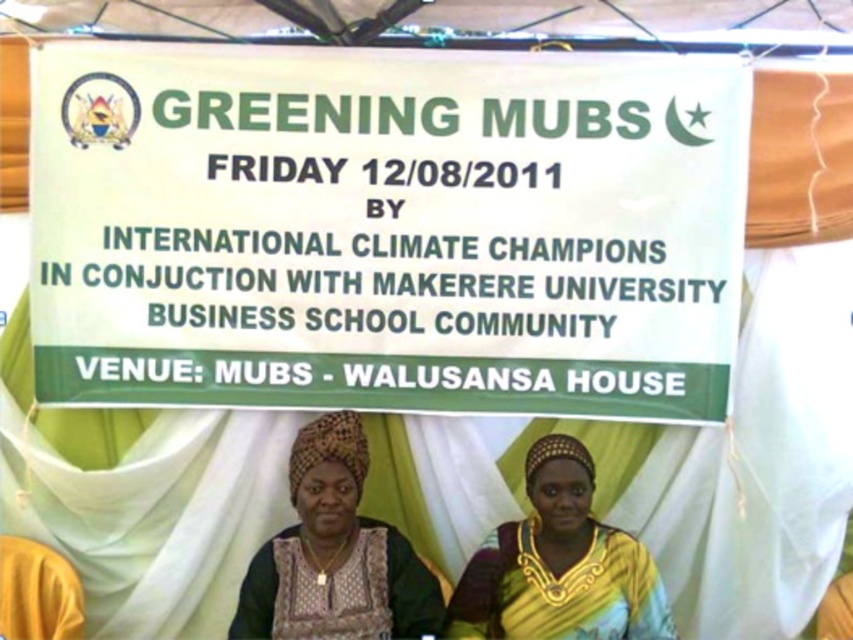
You are organizing an event and need to place a 3 feet wide table between the white paper sign at center and the black woven fabric headscarf at center. Is there enough space for the table?

The distance between the white paper sign at center and the black woven fabric headscarf at center is 9.20 feet. Since the table is 3 feet wide, there is sufficient space as 9.20 feet is greater than 3 feet.

You are standing at the entrance of the event venue and want to take a photo of the banner. The camera you have can focus on objects within 25 feet. Is the point at coordinates point (x=241, y=275) within the camera focus range?

The distance of point (x=241, y=275) from the camera is 23.56 feet, which is within the camera focus range of 25 feet. Therefore, the camera can focus on the point at coordinates point (x=241, y=275).

Based on the photo, you are at the event and want to read the main text of the banner. Which object should you look at first, the white paper sign at center or the yellow fabric headscarf at center?

The white paper sign at center has a smaller size compared to the yellow fabric headscarf at center, so you should look at the yellow fabric headscarf at center first because it is larger and likely contains the main text of the banner.